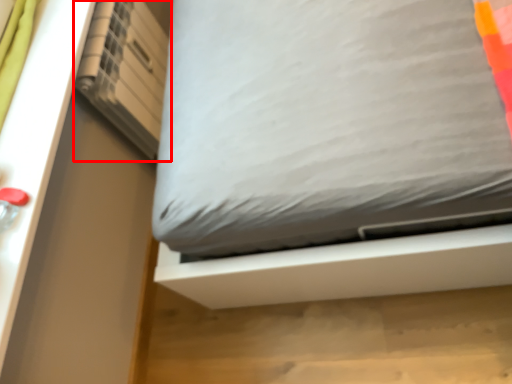
Question: From the image's perspective, where is shelf (annotated by the red box) located relative to bed?

Choices:
 (A) above
 (B) below

Answer: (A)